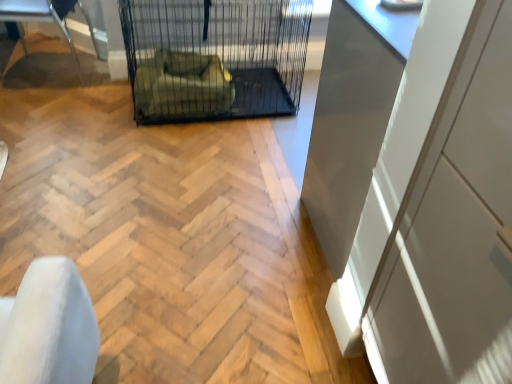
Question: Is green fabric armchair at center facing away from metallic silver chair at left?

Choices:
 (A) no
 (B) yes

Answer: (A)

Question: Does green fabric armchair at center have a greater height compared to metallic silver chair at left?

Choices:
 (A) no
 (B) yes

Answer: (A)

Question: Can you confirm if green fabric armchair at center is positioned to the right of metallic silver chair at left?

Choices:
 (A) yes
 (B) no

Answer: (A)

Question: Is green fabric armchair at center oriented towards metallic silver chair at left?

Choices:
 (A) yes
 (B) no

Answer: (B)

Question: From the image's perspective, is green fabric armchair at center located above metallic silver chair at left?

Choices:
 (A) no
 (B) yes

Answer: (A)

Question: Is metallic silver chair at left spatially inside black wire mesh cage at center, or outside of it?

Choices:
 (A) outside
 (B) inside

Answer: (A)

Question: Considering the positions of metallic silver chair at left and black wire mesh cage at center in the image, is metallic silver chair at left bigger or smaller than black wire mesh cage at center?

Choices:
 (A) big
 (B) small

Answer: (B)

Question: From the image's perspective, is metallic silver chair at left located above or below black wire mesh cage at center?

Choices:
 (A) below
 (B) above

Answer: (B)

Question: Visually, is metallic silver chair at left positioned to the left or to the right of black wire mesh cage at center?

Choices:
 (A) left
 (B) right

Answer: (A)

Question: Is point (416, 347) positioned closer to the camera than point (283, 86)?

Choices:
 (A) closer
 (B) farther

Answer: (A)

Question: From the image's perspective, is white glossy cabinet at right above or below black wire mesh cage at center?

Choices:
 (A) below
 (B) above

Answer: (A)

Question: Is white glossy cabinet at right spatially inside black wire mesh cage at center, or outside of it?

Choices:
 (A) inside
 (B) outside

Answer: (B)

Question: From a real-world perspective, is white glossy cabinet at right physically located above or below black wire mesh cage at center?

Choices:
 (A) below
 (B) above

Answer: (B)

Question: Would you say green fabric armchair at center is to the left or to the right of black wire mesh cage at center in the picture?

Choices:
 (A) right
 (B) left

Answer: (B)

Question: From a real-world perspective, is green fabric armchair at center positioned above or below black wire mesh cage at center?

Choices:
 (A) above
 (B) below

Answer: (B)